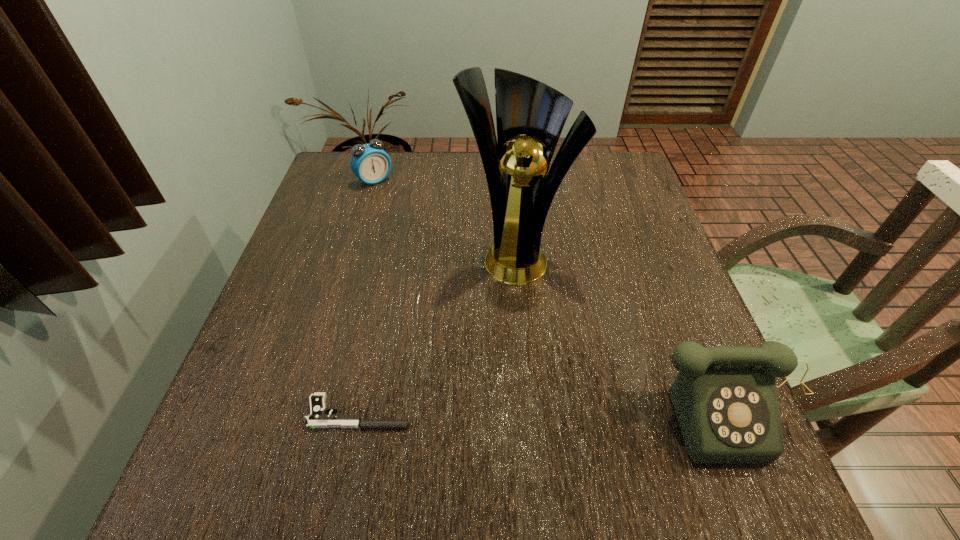
Find the location of a particular element. object positioned at the far left corner is located at coordinates (370, 163).

Find the location of a particular element. object located in the near left corner section of the desktop is located at coordinates (318, 418).

The width and height of the screenshot is (960, 540). What are the coordinates of `object that is at the near right corner` in the screenshot? It's located at tap(725, 400).

This screenshot has width=960, height=540. In the image, there is a desktop. In order to click on vacant area at the far edge in this screenshot , I will do `click(392, 158)`.

Find the location of a particular element. Image resolution: width=960 pixels, height=540 pixels. vacant area at the near edge of the desktop is located at coordinates 493,414.

Find the location of a particular element. The width and height of the screenshot is (960, 540). vacant space at the left edge is located at coordinates (279, 282).

In the image, there is a desktop. At what (x,y) coordinates should I click in order to perform the action: click on vacant space at the right edge. Please return your answer as a coordinate pair (x, y). The width and height of the screenshot is (960, 540). Looking at the image, I should click on (644, 323).

Find the location of a particular element. This screenshot has width=960, height=540. vacant space at the near left corner is located at coordinates (230, 434).

The width and height of the screenshot is (960, 540). Identify the location of unoccupied position between the farthest object and the third shortest object. (556, 294).

Identify the location of empty location between the alarm clock and the pistol. Image resolution: width=960 pixels, height=540 pixels. (367, 296).